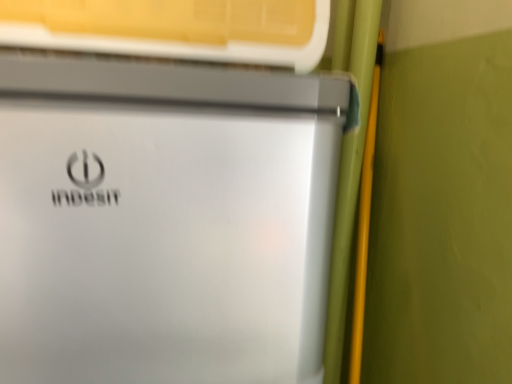
Describe the element at coordinates (164, 220) in the screenshot. I see `satin silver refrigerator at center` at that location.

Where is `satin silver refrigerator at center`? satin silver refrigerator at center is located at coordinates (164, 220).

Where is `satin silver refrigerator at center`? Image resolution: width=512 pixels, height=384 pixels. satin silver refrigerator at center is located at coordinates (164, 220).